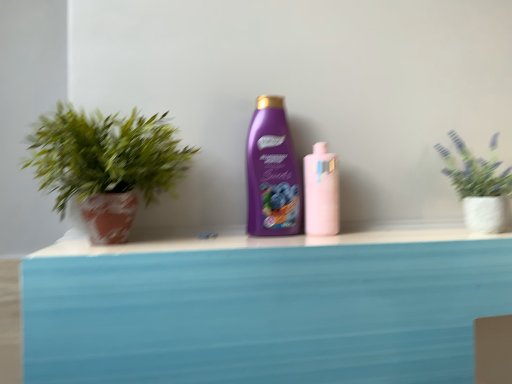
Question: From a real-world perspective, is green leafy plant in textured pot at upper right, which is the second houseplant from left to right, physically located above or below pink glossy bottle at center, the 1th bottle when ordered from right to left?

Choices:
 (A) above
 (B) below

Answer: (A)

Question: Is green leafy plant in textured pot at upper right, the 1th houseplant viewed from the right, inside or outside of pink glossy bottle at center, the 1th bottle when ordered from right to left?

Choices:
 (A) outside
 (B) inside

Answer: (A)

Question: Based on their relative distances, which object is farther from the green leafy plant in textured pot at upper right, the 1th houseplant viewed from the right?

Choices:
 (A) purple glossy shampoo at center, the first bottle in the left-to-right sequence
 (B) green matte plant at left, placed as the 2th houseplant when sorted from right to left
 (C) pink glossy bottle at center, the 1th bottle when ordered from right to left

Answer: (B)

Question: Estimate the real-world distances between objects in this image. Which object is closer to the green matte plant at left, the 1th houseplant viewed from the left?

Choices:
 (A) pink glossy bottle at center, the 1th bottle when ordered from right to left
 (B) purple glossy shampoo at center, the 2th bottle viewed from the right
 (C) green leafy plant in textured pot at upper right, the 1th houseplant viewed from the right

Answer: (B)